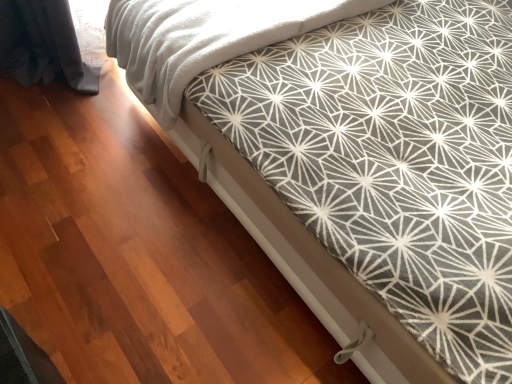
Describe the element at coordinates (205, 38) in the screenshot. This screenshot has width=512, height=384. I see `gray soft blanket at upper center` at that location.

Identify the location of gray soft blanket at upper center. This screenshot has height=384, width=512. (205, 38).

The image size is (512, 384). I want to click on gray soft blanket at upper center, so [205, 38].